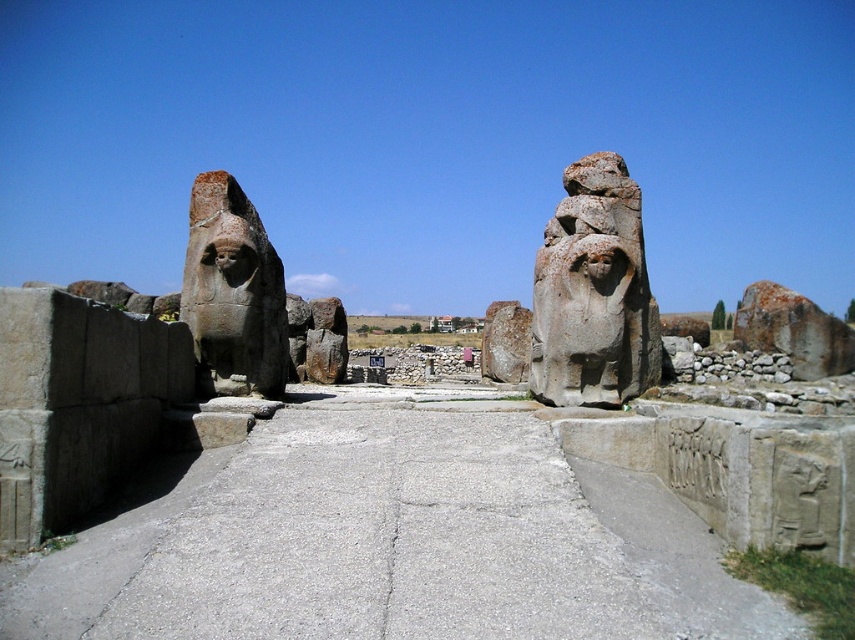
You are standing at the archaeological site and want to take a photo of the gray concrete pavement at center. Where should you position yourself to capture it in the frame?

To capture the gray concrete pavement at center in the frame, you should position yourself at point (394, 545).